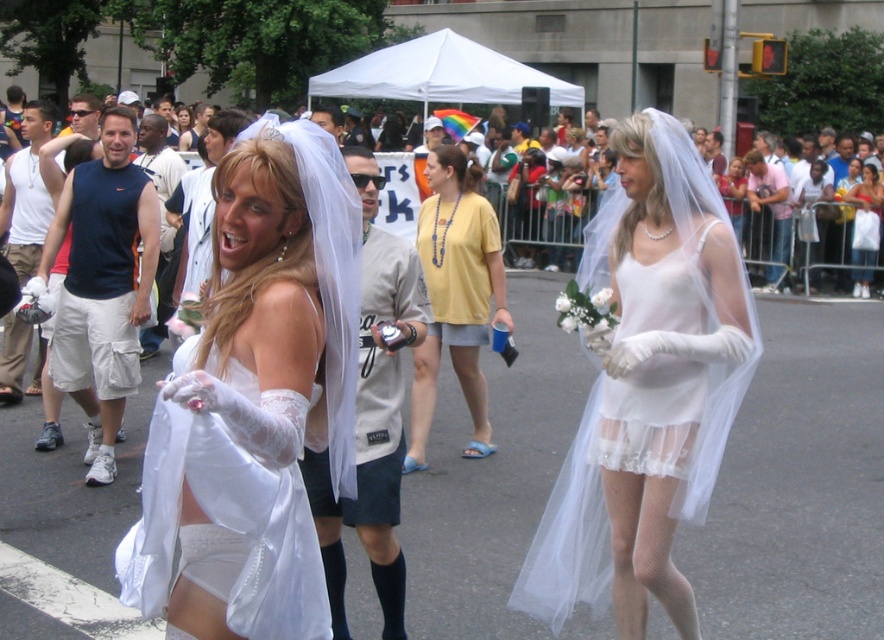
Who is more distant from viewer, (x=395, y=508) or (x=833, y=172)?

The point (x=833, y=172) is more distant.

Who is more forward, (410, 301) or (837, 179)?

Point (410, 301) is in front.

This screenshot has width=884, height=640. I want to click on matte gray t-shirt at center, so click(372, 413).

Between point (240, 552) and point (306, 477), which one is positioned in front?

Positioned in front is point (240, 552).

Who is lower down, satin white dress at center or matte gray t-shirt at center?

matte gray t-shirt at center is lower down.

This screenshot has height=640, width=884. Identify the location of satin white dress at center. (255, 403).

Does dark blue fabric tank top at left appear over white satin dress at center?

Actually, dark blue fabric tank top at left is below white satin dress at center.

Identify the location of dark blue fabric tank top at left. The width and height of the screenshot is (884, 640). (103, 285).

At what (x,y) coordinates should I click in order to perform the action: click on dark blue fabric tank top at left. Please return your answer as a coordinate pair (x, y). The image size is (884, 640). Looking at the image, I should click on (103, 285).